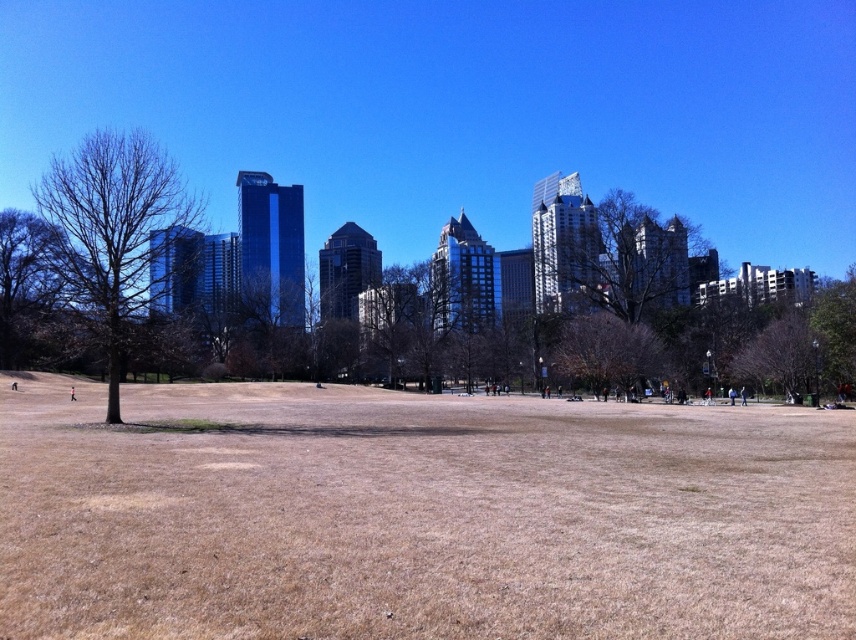
Who is positioned more to the right, brown textured tree at lower right or green leafy tree at right?

Positioned to the right is green leafy tree at right.

Who is taller, brown textured tree at lower right or green leafy tree at right?

green leafy tree at right

Who is more distant from viewer, (785,339) or (829,314)?

The point (829,314) is behind.

At what (x,y) coordinates should I click in order to perform the action: click on brown textured tree at lower right. Please return your answer as a coordinate pair (x, y). Looking at the image, I should click on (782, 355).

Is point (693, 275) in front of point (807, 384)?

That is False.

Which is more to the left, green leafy tree at center or brown textured tree at lower right?

green leafy tree at center is more to the left.

Is point (634, 198) positioned before point (786, 324)?

No, it is behind (786, 324).

Where is `green leafy tree at center`? The width and height of the screenshot is (856, 640). green leafy tree at center is located at coordinates (625, 259).

This screenshot has height=640, width=856. What do you see at coordinates (111, 237) in the screenshot?
I see `bare brown tree at left` at bounding box center [111, 237].

Is bare brown tree at left to the right of brown textured tree at lower right from the viewer's perspective?

No, bare brown tree at left is not to the right of brown textured tree at lower right.

Image resolution: width=856 pixels, height=640 pixels. In order to click on bare brown tree at left in this screenshot , I will do point(111,237).